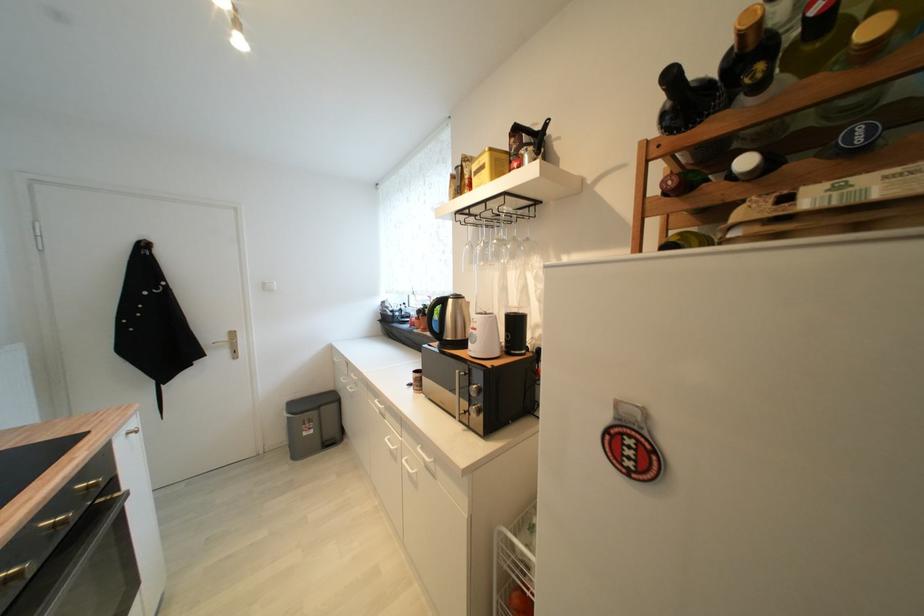
Locate an element on the screen. The height and width of the screenshot is (616, 924). brown coffee mug is located at coordinates (515, 333).